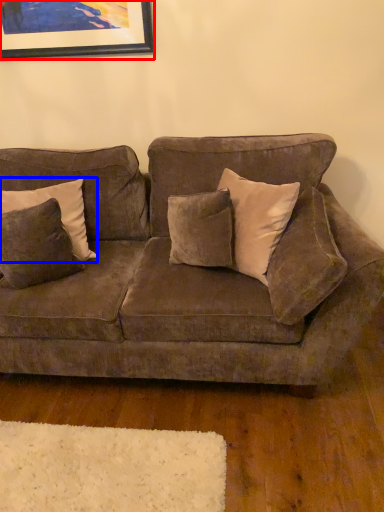
Question: Which object appears closest to the camera in this image, picture frame (highlighted by a red box) or pillow (highlighted by a blue box)?

Choices:
 (A) picture frame
 (B) pillow

Answer: (B)